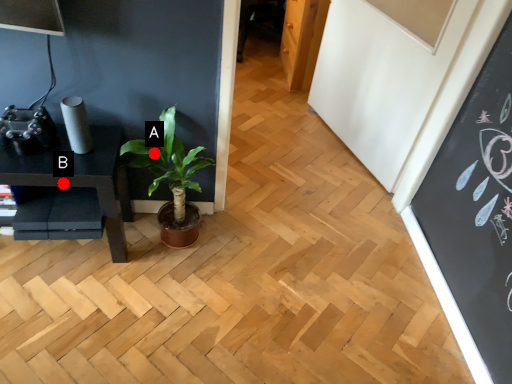
Question: Two points are circled on the image, labeled by A and B beside each circle. Which point appears closest to the camera in this image?

Choices:
 (A) A is closer
 (B) B is closer

Answer: (B)